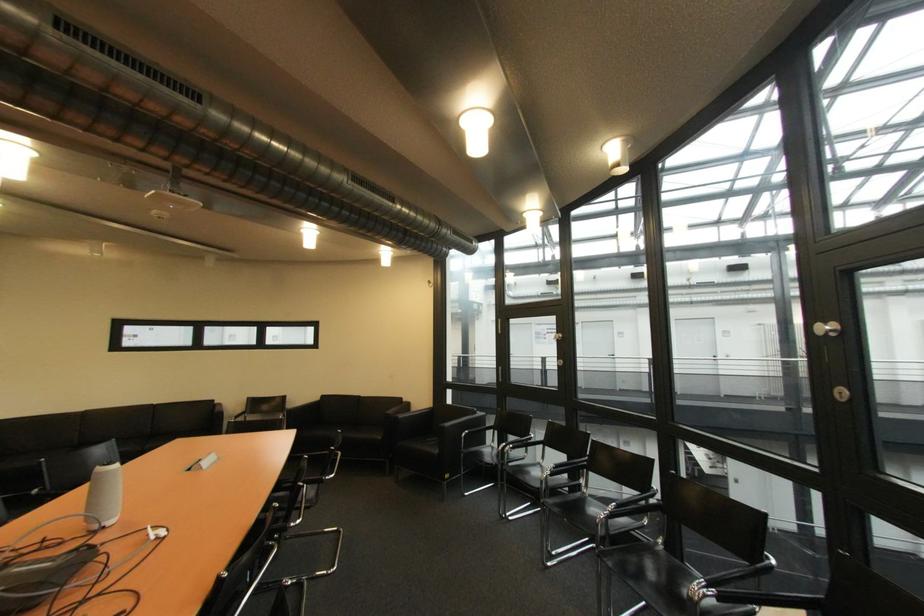
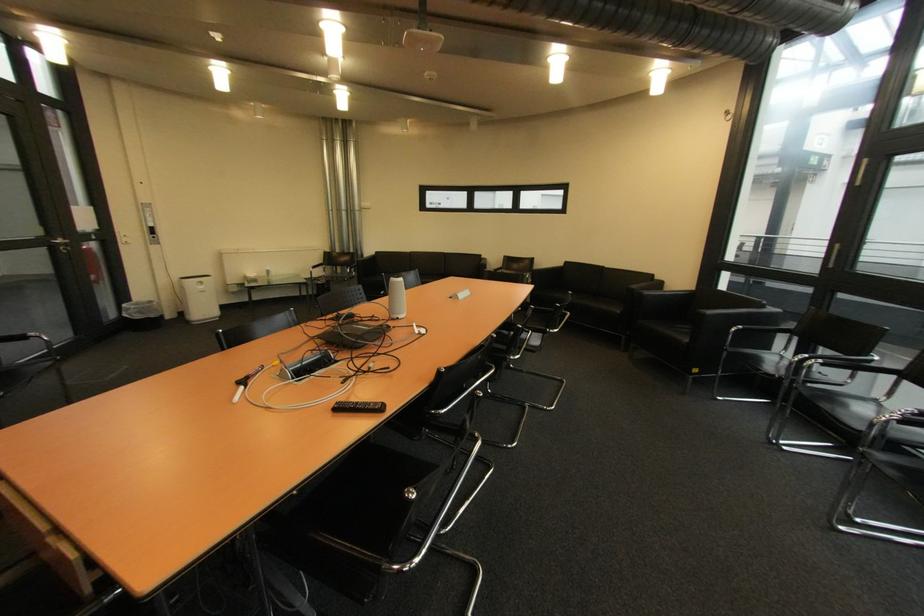
Question: I am providing you with two images of the same scene from different viewpoints. Please identify which objects are invisible in image2.

Choices:
 (A) sofa sitting surface
 (B) white marker pen
 (C) black mesh trashcan
 (D) none of these

Answer: (D)